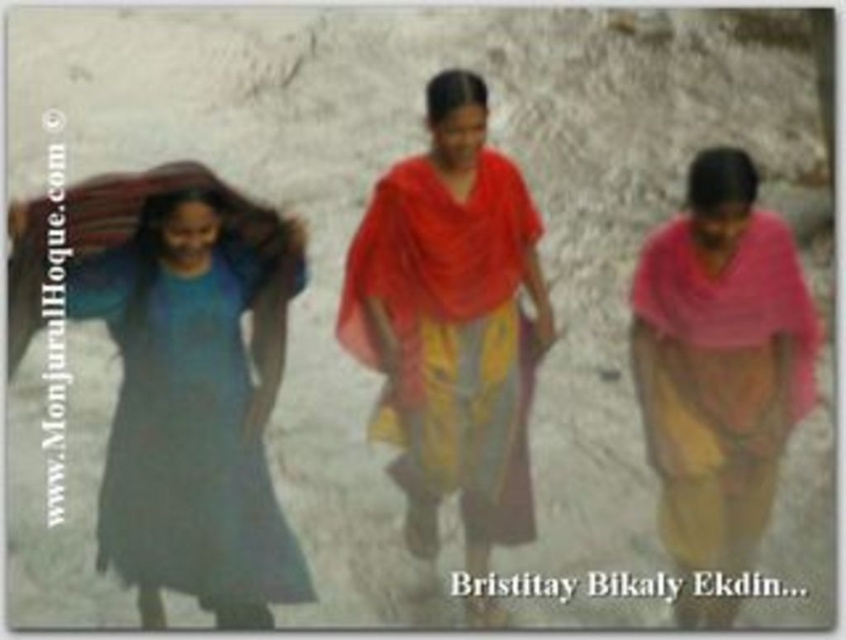
You are standing at the point with coordinates point (205, 586) and want to walk towards the point with coordinates point (537, 218). Given that the path is sandy and the two points are part of the same path, will you have to walk uphill or downhill?

Since point (205, 586) is closer to the camera than point (537, 218), this implies that point (205, 586) is in the foreground. Therefore, walking from point (205, 586) to point (537, 218) would mean moving towards the background, which typically corresponds to going uphill in such a perspective. So you would have to walk uphill.

Based on the coordinates provided, which object is located at point [451,324]?

The matte red shawl at center is located at point [451,324].

You are a photographer trying to capture a photo of the matte red shawl at center and the matte blue dress at left. Based on their heights, which object should you focus on first if you want to ensure both are in focus?

The matte red shawl at center is much taller than the matte blue dress at left, so you should focus on the matte red shawl at center first to ensure both are in focus.